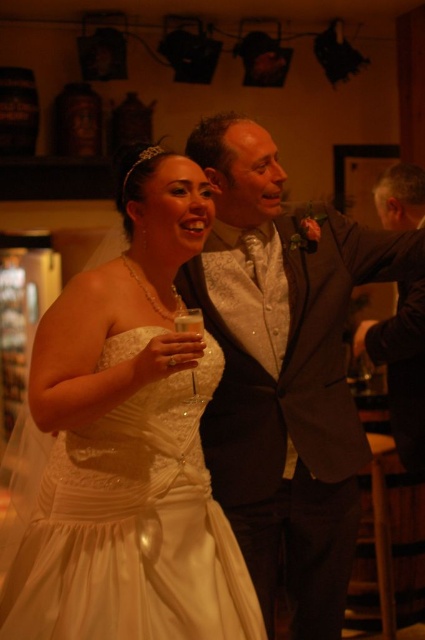
From the picture: Who is lower down, dark brown suit at right or clear glass wine glass at center?

dark brown suit at right

Which is above, dark brown suit at right or clear glass wine glass at center?

clear glass wine glass at center

Measure the distance between point (x=397, y=316) and camera.

Point (x=397, y=316) is 2.38 meters away from camera.

The width and height of the screenshot is (425, 640). What are the coordinates of `dark brown suit at right` in the screenshot? It's located at (402, 369).

Can you confirm if ivory satin dress at center is thinner than dark brown suit at right?

Incorrect, ivory satin dress at center's width is not less than dark brown suit at right's.

Is point (189, 202) farther from camera compared to point (402, 304)?

That is False.

Between point (104, 608) and point (374, 364), which one is positioned behind?

Point (374, 364)

Where is `ivory satin dress at center`? Image resolution: width=425 pixels, height=640 pixels. ivory satin dress at center is located at coordinates (124, 444).

The image size is (425, 640). Find the location of `shiny silver vest at center`. shiny silver vest at center is located at coordinates (283, 369).

Does point (322, 328) come behind point (197, 324)?

Yes, it is behind point (197, 324).

The height and width of the screenshot is (640, 425). Find the location of `shiny silver vest at center`. shiny silver vest at center is located at coordinates (283, 369).

Where is `shiny silver vest at center`? Image resolution: width=425 pixels, height=640 pixels. shiny silver vest at center is located at coordinates (283, 369).